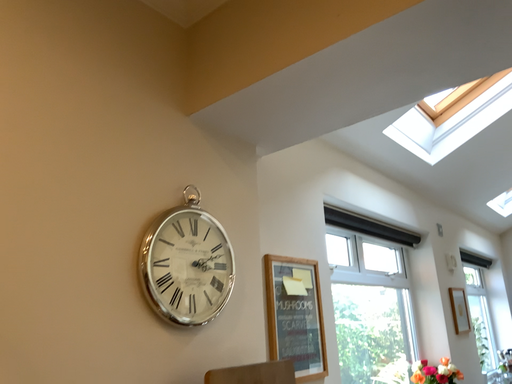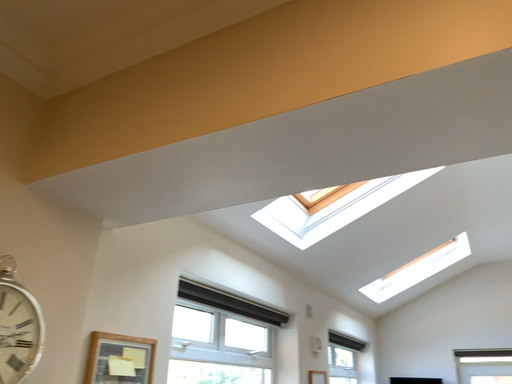
Question: How did the camera likely rotate when shooting the video?

Choices:
 (A) rotated downward
 (B) rotated upward

Answer: (B)